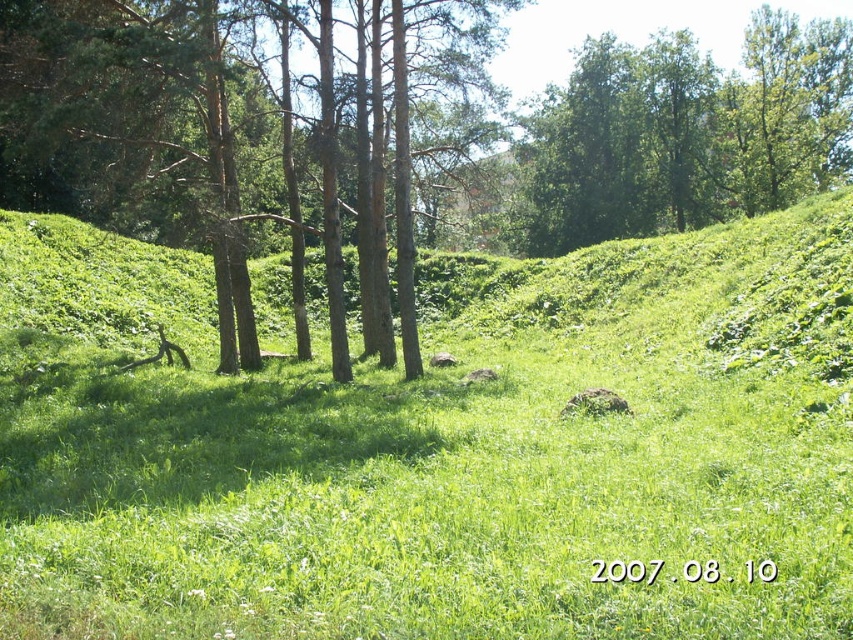
Question: Is green grassy at center closer to camera compared to green leafy tree at upper center?

Choices:
 (A) yes
 (B) no

Answer: (A)

Question: Which point is farther to the camera?

Choices:
 (A) green leafy tree at upper center
 (B) green bark tree at center

Answer: (A)

Question: Which object appears closest to the camera in this image?

Choices:
 (A) green grassy at center
 (B) green leafy tree at upper center
 (C) green bark tree at center

Answer: (A)

Question: Considering the relative positions of green grassy at center and green leafy tree at upper center in the image provided, where is green grassy at center located with respect to green leafy tree at upper center?

Choices:
 (A) above
 (B) below

Answer: (B)

Question: Which object is farther from the camera taking this photo?

Choices:
 (A) green bark tree at center
 (B) green grassy at center
 (C) green leafy tree at upper center

Answer: (C)

Question: Does green grassy at center have a greater width compared to green bark tree at center?

Choices:
 (A) no
 (B) yes

Answer: (B)